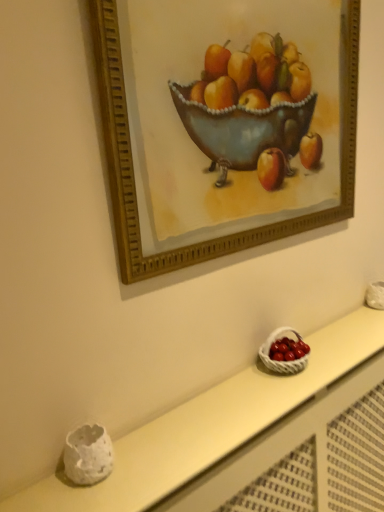
Find the location of `vacant area in front of white wicker basket at lower right`. vacant area in front of white wicker basket at lower right is located at coordinates (278, 396).